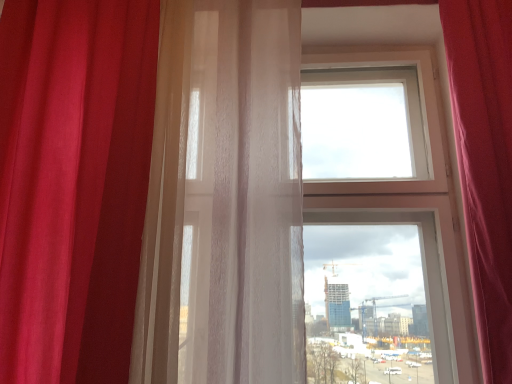
Question: Is satin red curtain at left, marked as the first curtain in a left-to-right arrangement, bigger or smaller than velvet red curtain at right, which is counted as the first curtain, starting from the right?

Choices:
 (A) big
 (B) small

Answer: (A)

Question: From the image's perspective, is satin red curtain at left, which ranks as the 3th curtain in right-to-left order, positioned above or below velvet red curtain at right, the third curtain in the left-to-right sequence?

Choices:
 (A) above
 (B) below

Answer: (A)

Question: Considering the real-world distances, which object is farthest from the velvet red curtain at right, the third curtain in the left-to-right sequence?

Choices:
 (A) translucent white curtain at left, which ranks as the second curtain in left-to-right order
 (B) satin red curtain at left, which ranks as the 3th curtain in right-to-left order

Answer: (B)

Question: Based on their relative distances, which object is farther from the satin red curtain at left, which ranks as the 3th curtain in right-to-left order?

Choices:
 (A) velvet red curtain at right, which is counted as the first curtain, starting from the right
 (B) translucent white curtain at left, which ranks as the second curtain in right-to-left order

Answer: (A)